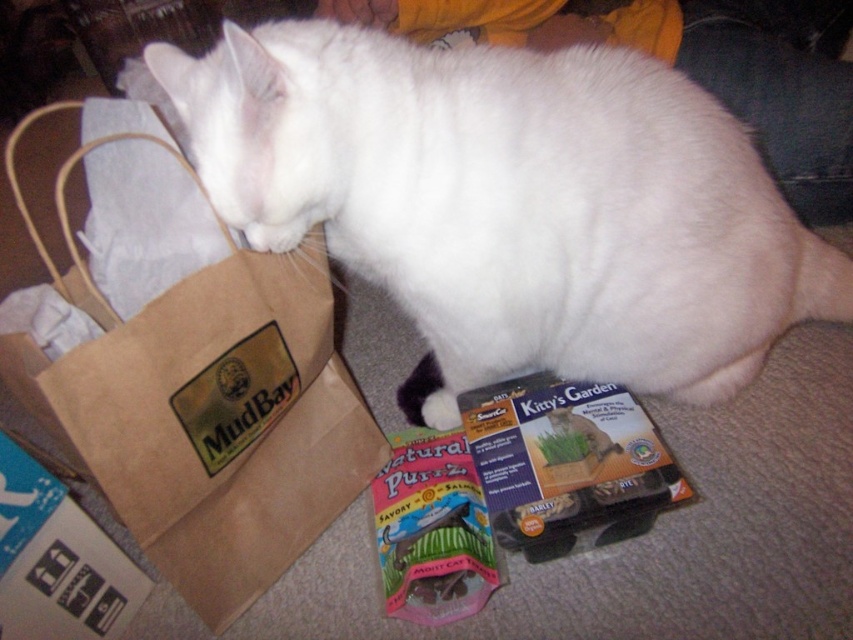
Question: Among these points, which one is farthest from the camera?

Choices:
 (A) (753, 356)
 (B) (531, 397)
 (C) (148, 529)
 (D) (80, 616)

Answer: (A)

Question: Is white fur cat at upper left bigger than matte cardboard box at lower center?

Choices:
 (A) no
 (B) yes

Answer: (B)

Question: Based on their relative distances, which object is farther from the blue cardboard box at lower left?

Choices:
 (A) brown paper bag at left
 (B) matte cardboard box at lower center
 (C) white fur cat at upper left

Answer: (C)

Question: Can you confirm if brown paper bag at left is positioned to the right of matte cardboard box at lower center?

Choices:
 (A) no
 (B) yes

Answer: (A)

Question: Considering the real-world distances, which object is farthest from the white fur cat at upper left?

Choices:
 (A) matte cardboard box at lower center
 (B) brown paper bag at left

Answer: (B)

Question: Does white fur cat at upper left lie behind matte cardboard box at lower center?

Choices:
 (A) no
 (B) yes

Answer: (A)